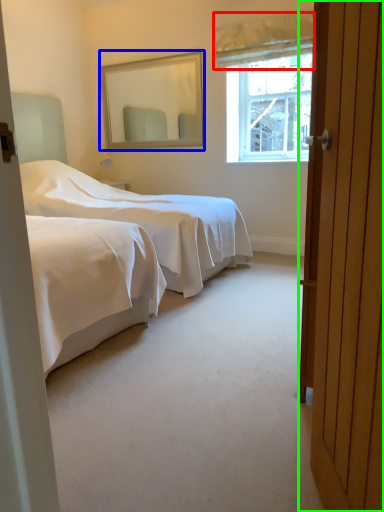
Question: Estimate the real-world distances between objects in this image. Which object is closer to curtain (highlighted by a red box), mirror (highlighted by a blue box) or door (highlighted by a green box)?

Choices:
 (A) mirror
 (B) door

Answer: (A)